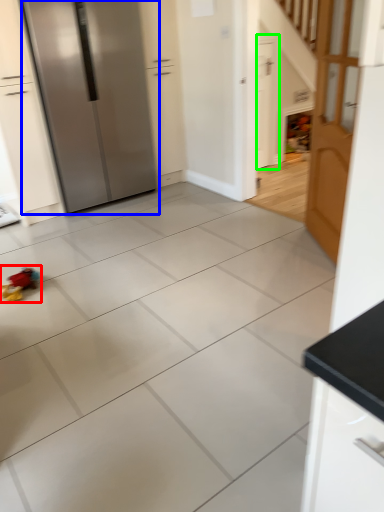
Question: Considering the real-world distances, which object is farthest from toy (highlighted by a red box)? refrigerator (highlighted by a blue box) or door (highlighted by a green box)?

Choices:
 (A) refrigerator
 (B) door

Answer: (B)